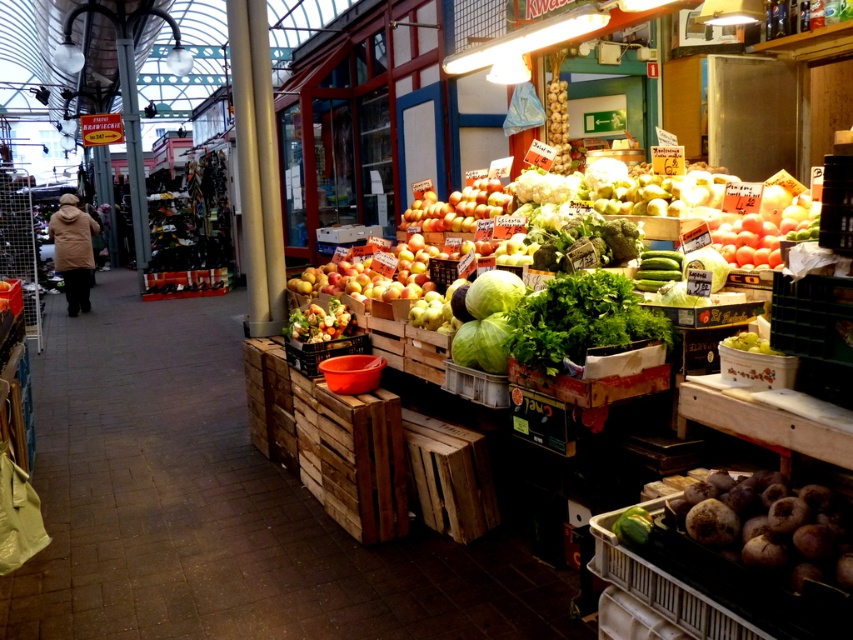
You are a customer at the market and want to find the shiny golden apples at center. According to the stall layout, where should you look relative to the orange bucket?

The shiny golden apples at center are located at point 0.319 on the x axis and 0.821 on the y axis, which is to the left and slightly below the orange bucket.